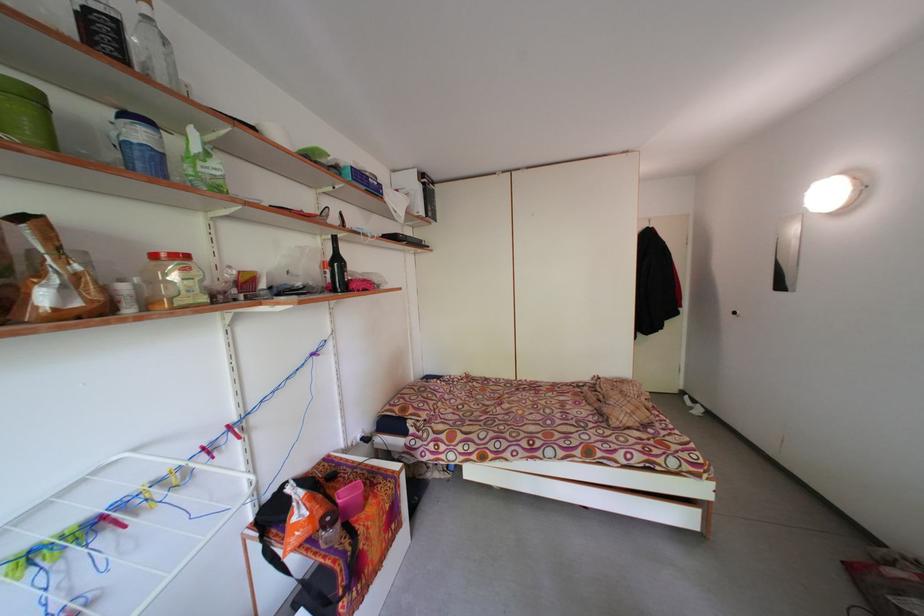
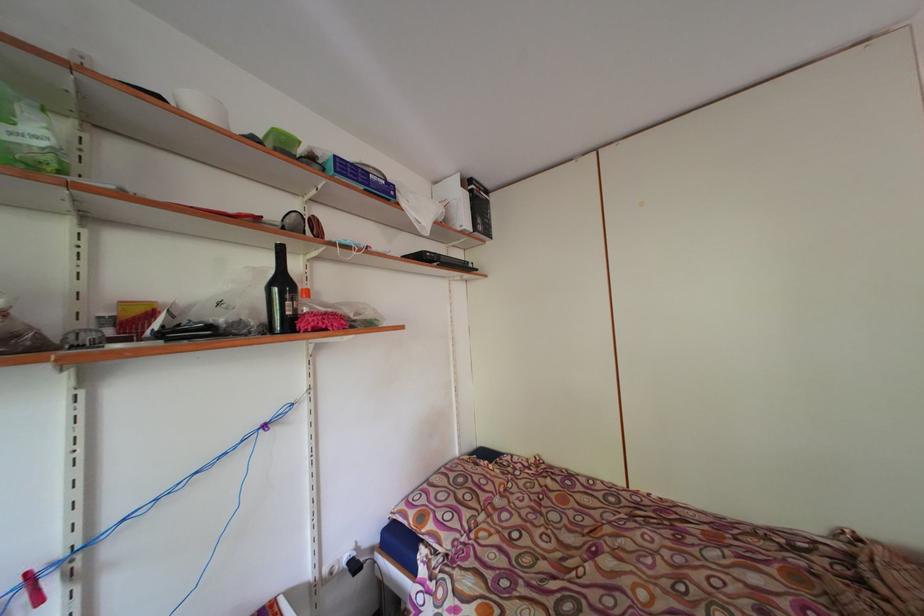
Question: In a continuous first-person perspective shot, in which direction is the camera moving?

Choices:
 (A) Left
 (B) Right
 (C) Forward
 (D) Backward

Answer: (C)